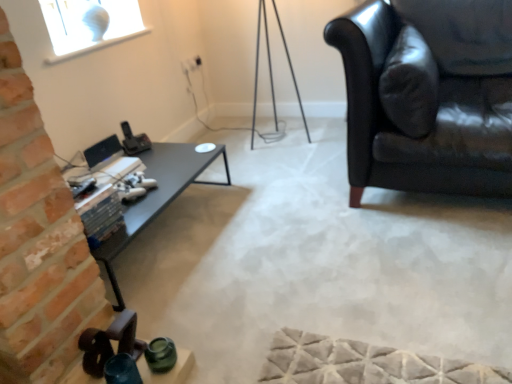
The width and height of the screenshot is (512, 384). What are the coordinates of `vacant space that's between black leather couch at right and black glossy table at left` in the screenshot? It's located at (283, 220).